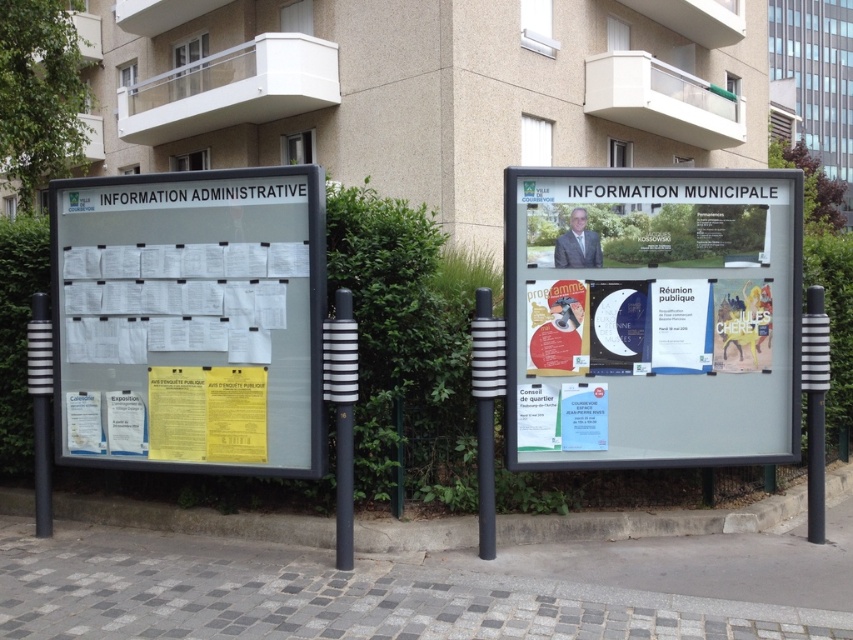
Question: Can you confirm if white plastic board at center is bigger than white paper at left?

Choices:
 (A) yes
 (B) no

Answer: (B)

Question: Which object is closer to the camera taking this photo?

Choices:
 (A) white paper at left
 (B) green leafy hedge at left
 (C) white plastic board at center

Answer: (A)

Question: Does white plastic board at center have a lesser width compared to green leafy hedge at left?

Choices:
 (A) yes
 (B) no

Answer: (B)

Question: Which point is closer to the camera taking this photo?

Choices:
 (A) (177, 236)
 (B) (554, 400)
 (C) (3, 417)

Answer: (B)

Question: Which of the following is the closest to the observer?

Choices:
 (A) green leafy hedge at left
 (B) white paper at left

Answer: (B)

Question: Does white paper at left have a greater width compared to green leafy hedge at left?

Choices:
 (A) no
 (B) yes

Answer: (B)